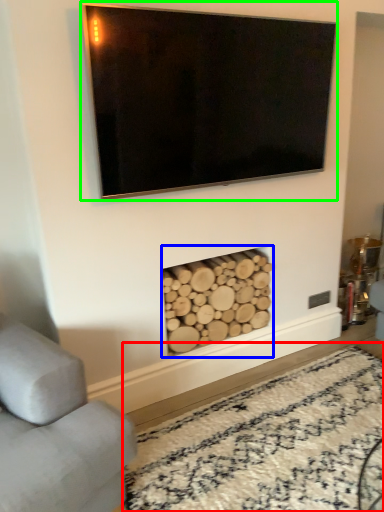
Question: Estimate the real-world distances between objects in this image. Which object is farther from plain (highlighted by a red box), fireplace (highlighted by a blue box) or television (highlighted by a green box)?

Choices:
 (A) fireplace
 (B) television

Answer: (B)